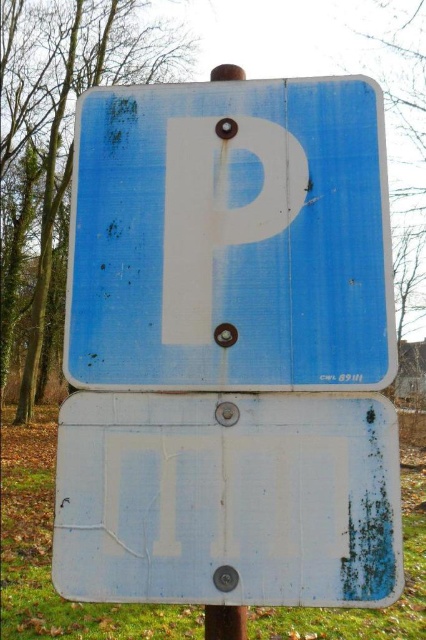
Question: Can you confirm if matte blue parking sign at center is positioned to the left of white matte sign at center?

Choices:
 (A) yes
 (B) no

Answer: (B)

Question: Which of the following is the closest to the observer?

Choices:
 (A) white matte sign at center
 (B) matte blue parking sign at center

Answer: (A)

Question: Can you confirm if matte blue parking sign at center is positioned above white matte sign at center?

Choices:
 (A) no
 (B) yes

Answer: (B)

Question: Which object appears farthest from the camera in this image?

Choices:
 (A) white matte sign at center
 (B) matte blue parking sign at center

Answer: (B)

Question: Is matte blue parking sign at center bigger than white matte sign at center?

Choices:
 (A) yes
 (B) no

Answer: (A)